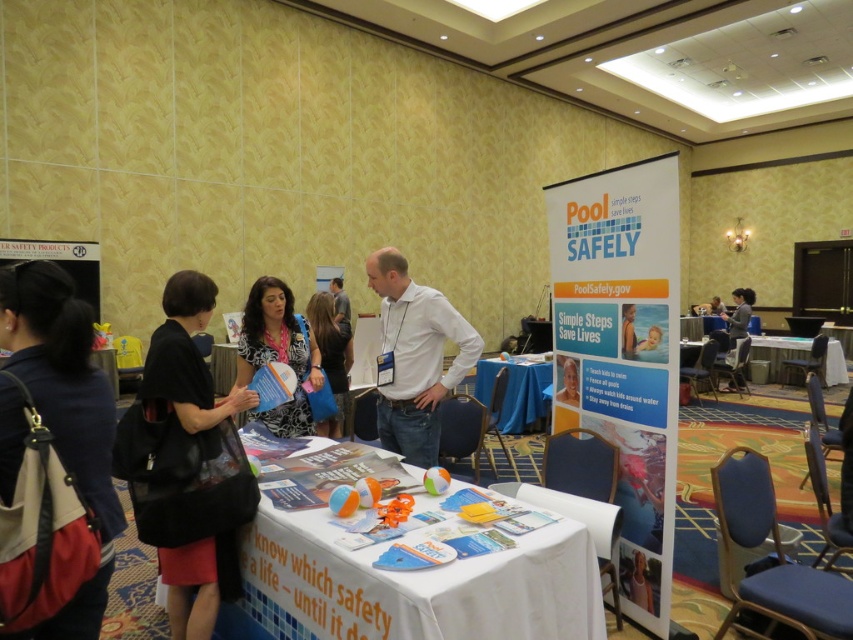
You are attending a pool safety event and need to hand out materials. You see the white paper at center and the matte white shirt at center. Which object is closer to you?

The white paper at center is closer to you because it is in front of the matte white shirt at center.